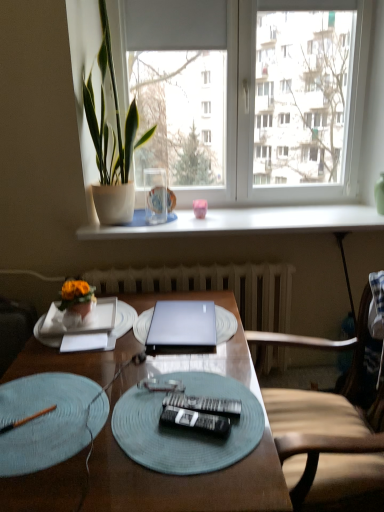
The width and height of the screenshot is (384, 512). I want to click on free location above light blue textured placemat at lower left (from a real-world perspective), so click(44, 414).